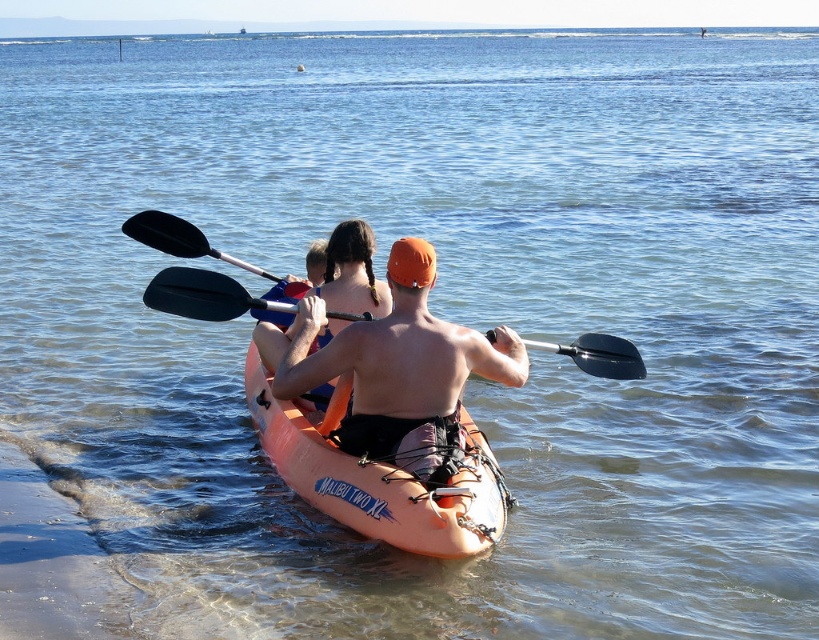
You are standing on the shore and see two points marked on the kayak. Which point is closer to you? The points are labeled as point (410, 348) and point (324, 470).

Point (410, 348) is closer to the viewer than point (324, 470).

You are a photographer trying to capture a clear photo of the orange fabric shirt at center and the black rubber paddle at center. Since the camera can only focus on one object at a time, which object should you choose to ensure the subject is in focus and not too small in the frame?

The orange fabric shirt at center has a greater height compared to the black rubber paddle at center, so you should focus on the orange fabric shirt at center to ensure it is large enough in the frame and in focus.